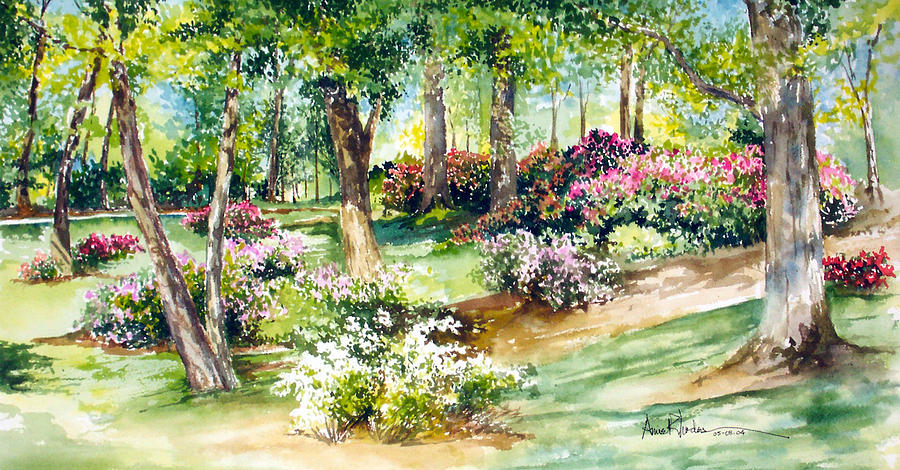
The height and width of the screenshot is (470, 900). In order to click on watercolor painting in this screenshot , I will do `click(454, 266)`.